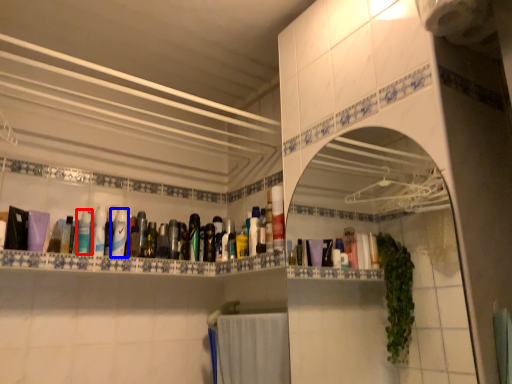
Question: Among these objects, which one is farthest to the camera, mouthwash (highlighted by a red box) or mouthwash (highlighted by a blue box)?

Choices:
 (A) mouthwash
 (B) mouthwash

Answer: (B)